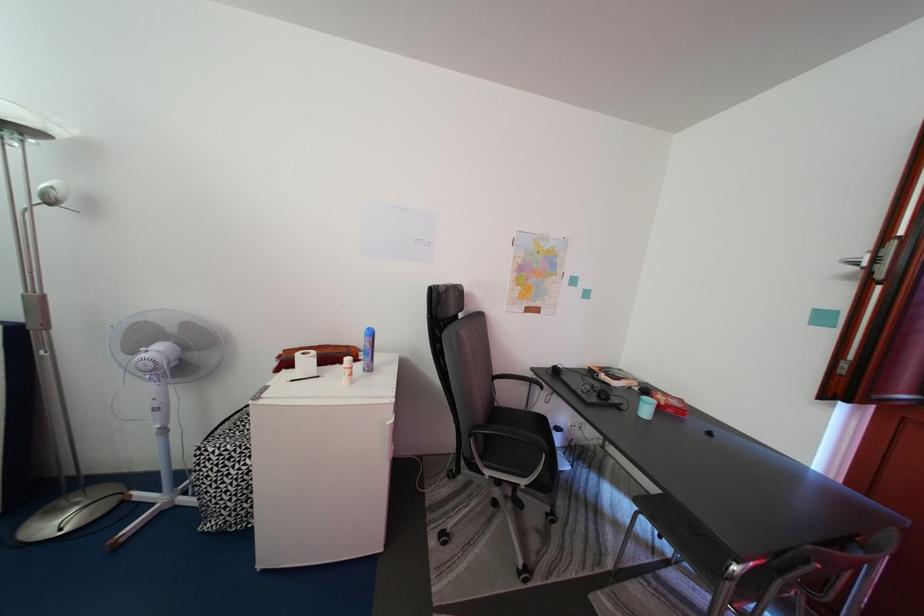
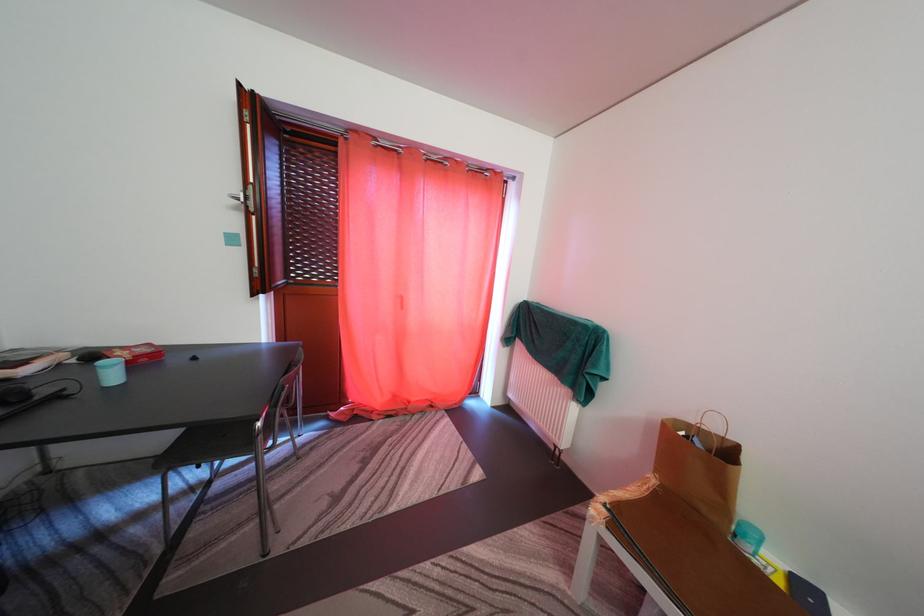
First-person continuous shooting, in which direction is the camera rotating?

The camera rotated toward right-down.